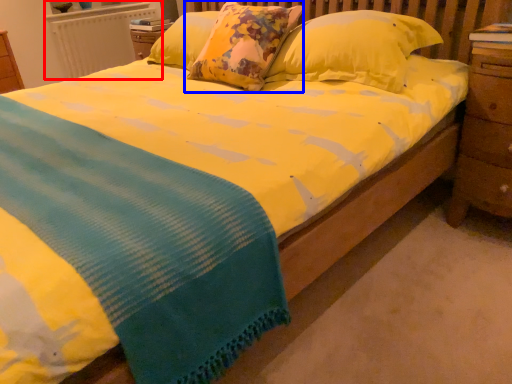
Question: Which point is further to the camera, radiator (highlighted by a red box) or pillow (highlighted by a blue box)?

Choices:
 (A) radiator
 (B) pillow

Answer: (A)